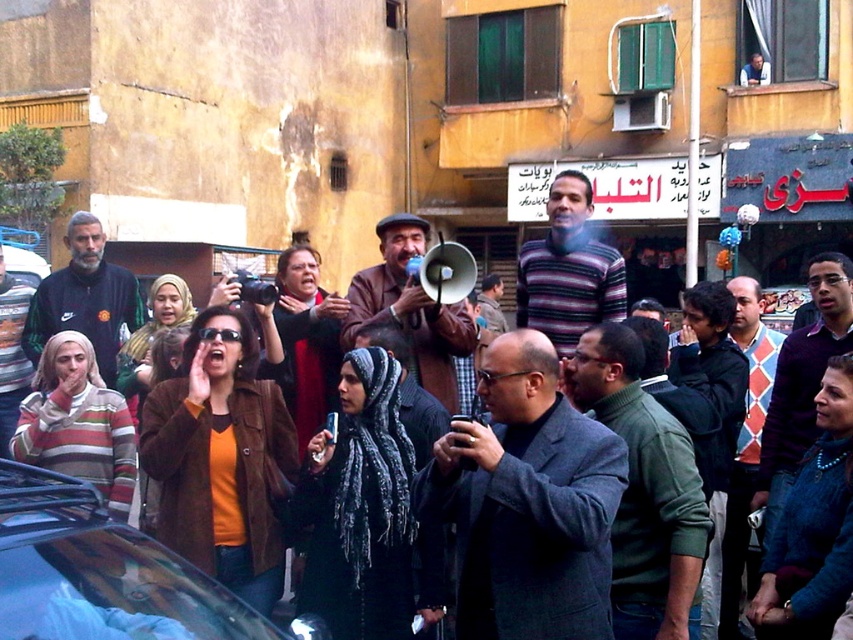
Can you confirm if metallic silver car at lower left is smaller than striped wool sweater at center?

No.

Between metallic silver car at lower left and striped wool sweater at center, which one is positioned higher?

striped wool sweater at center

In order to click on metallic silver car at lower left in this screenshot , I will do `click(100, 572)`.

Describe the element at coordinates (410, 308) in the screenshot. This screenshot has width=853, height=640. I see `brown leather jacket at center` at that location.

Can you confirm if brown leather jacket at center is positioned below argyle sweater at center?

No, brown leather jacket at center is not below argyle sweater at center.

Describe the element at coordinates (410, 308) in the screenshot. I see `brown leather jacket at center` at that location.

Locate an element on the screen. brown leather jacket at center is located at coordinates (410, 308).

Can you confirm if green wool sweater at center is taller than dark purple sweater at center?

In fact, green wool sweater at center may be shorter than dark purple sweater at center.

Does green wool sweater at center have a lesser width compared to dark purple sweater at center?

No.

Measure the distance between point [669,426] and camera.

They are 20.17 feet apart.

This screenshot has height=640, width=853. I want to click on green wool sweater at center, so click(643, 490).